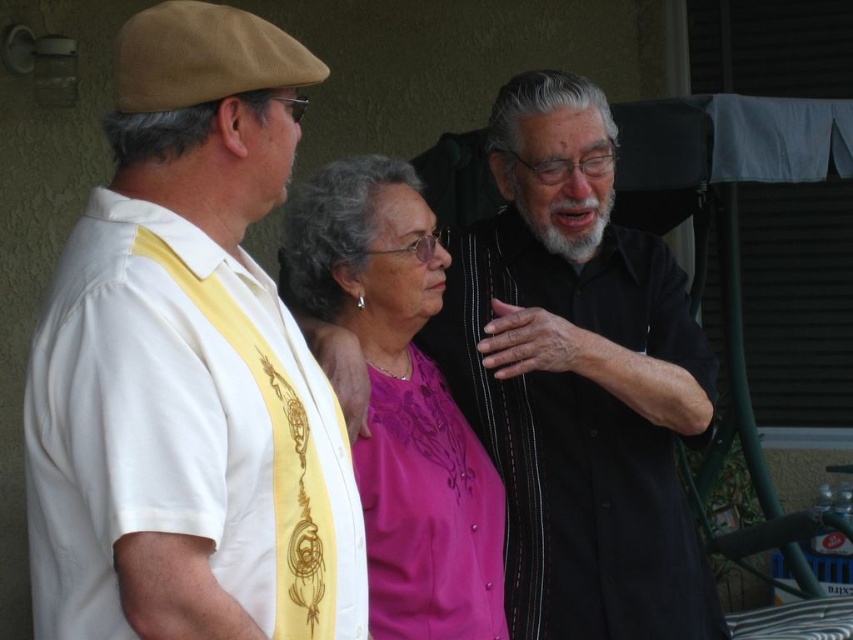
Based on the photo, who is taller, white matte shirt at left or purple satin blouse at center?

Standing taller between the two is purple satin blouse at center.

At what (x,y) coordinates should I click in order to perform the action: click on white matte shirt at left. Please return your answer as a coordinate pair (x, y). Looking at the image, I should click on (189, 368).

The image size is (853, 640). Identify the location of white matte shirt at left. (189, 368).

Find the location of a particular element. white matte shirt at left is located at coordinates (189, 368).

Can you confirm if white matte shirt at left is positioned to the left of black textured shirt at center?

Indeed, white matte shirt at left is positioned on the left side of black textured shirt at center.

Measure the distance between point (132, 202) and camera.

Point (132, 202) and camera are 5.17 feet apart.

Who is more forward, (x=125, y=374) or (x=498, y=280)?

Point (x=125, y=374)

Where is `white matte shirt at left`? white matte shirt at left is located at coordinates (189, 368).

Looking at this image, does black textured shirt at center come behind purple satin blouse at center?

Yes, it is behind purple satin blouse at center.

In the scene shown: Is black textured shirt at center thinner than purple satin blouse at center?

In fact, black textured shirt at center might be wider than purple satin blouse at center.

Identify the location of black textured shirt at center. This screenshot has width=853, height=640. (578, 380).